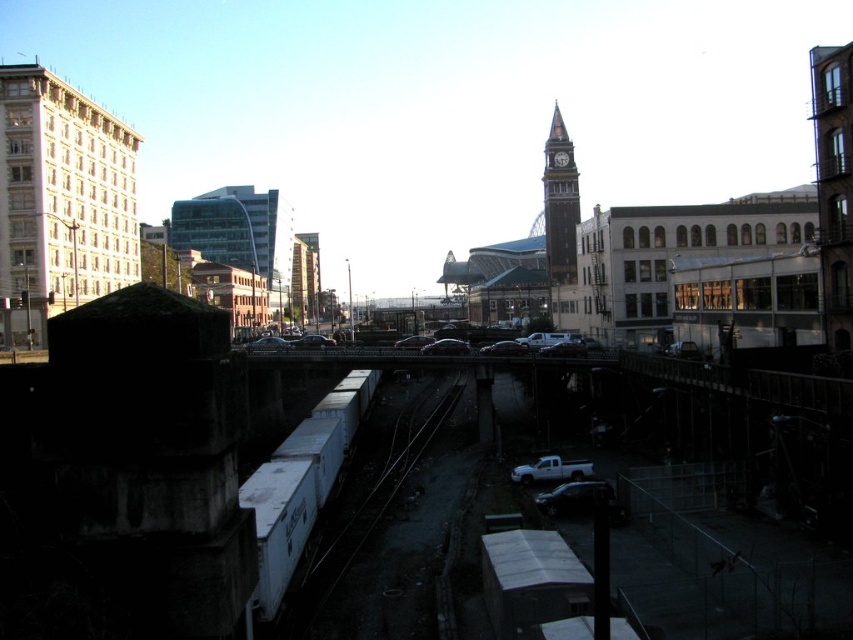
Between white textured building at left and shiny black sedan at center, which one has less height?

With less height is shiny black sedan at center.

Between point (15, 81) and point (306, 339), which one is positioned behind?

Positioned behind is point (306, 339).

I want to click on white textured building at left, so click(x=61, y=200).

Which is more to the left, white textured building at left or white matte train car at lower left?

From the viewer's perspective, white textured building at left appears more on the left side.

Can you confirm if white textured building at left is positioned below white matte train car at lower left?

Actually, white textured building at left is above white matte train car at lower left.

Is point (33, 316) farther from viewer compared to point (286, 493)?

Yes, point (33, 316) is behind point (286, 493).

At what (x,y) coordinates should I click in order to perform the action: click on white textured building at left. Please return your answer as a coordinate pair (x, y). The image size is (853, 640). Looking at the image, I should click on (61, 200).

Who is more distant from viewer, (65, 179) or (523, 468)?

The point (65, 179) is behind.

Which is more to the left, white textured building at left or white matte truck at lower center?

white textured building at left

Does point (55, 248) come in front of point (521, 465)?

No, it is not.

The image size is (853, 640). What are the coordinates of `white textured building at left` in the screenshot? It's located at (61, 200).